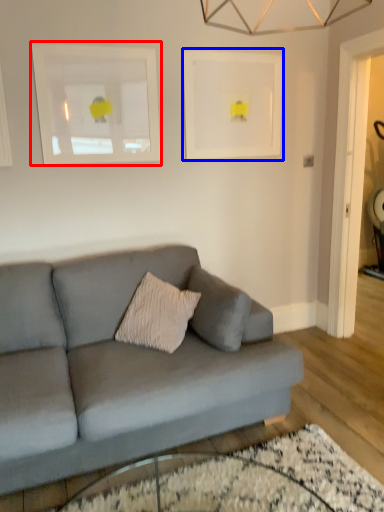
Question: Which object appears closest to the camera in this image, picture frame (highlighted by a red box) or picture frame (highlighted by a blue box)?

Choices:
 (A) picture frame
 (B) picture frame

Answer: (A)